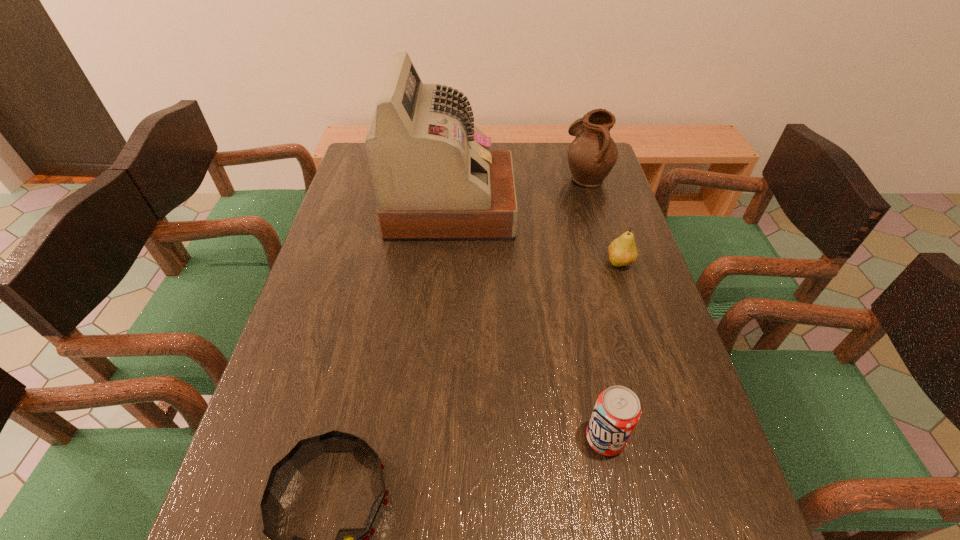
Locate an element on the screen. Image resolution: width=960 pixels, height=540 pixels. the tallest object is located at coordinates (435, 178).

Where is `pitcher`? The width and height of the screenshot is (960, 540). pitcher is located at coordinates (592, 154).

Locate an element on the screen. soda can is located at coordinates (617, 411).

Find the location of `pear`. pear is located at coordinates pos(622,252).

The height and width of the screenshot is (540, 960). In order to click on the shortest object in this screenshot , I will do `click(622, 252)`.

The width and height of the screenshot is (960, 540). Identify the location of vacant point located on the operating side of the tallest object. (561, 206).

This screenshot has height=540, width=960. I want to click on free space located at the spout of the fourth shortest object, so click(x=549, y=177).

Image resolution: width=960 pixels, height=540 pixels. In order to click on vacant space located 0.280m at the spout of the fourth shortest object in this screenshot , I will do `click(481, 177)`.

Locate an element on the screen. free space located 0.160m at the spout of the fourth shortest object is located at coordinates (516, 177).

The image size is (960, 540). I want to click on free space located 0.070m on the back of the third object from right to left, so click(594, 390).